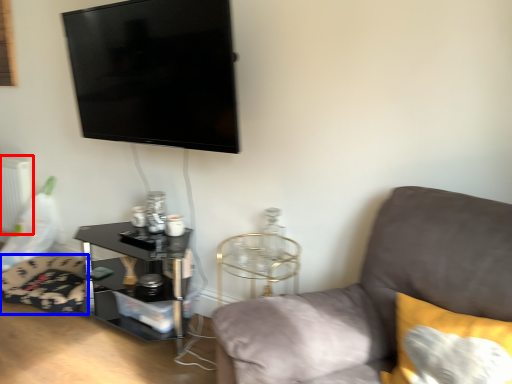
Question: Which of the following is the closest to the observer, radiator (highlighted by a red box) or swivel chair (highlighted by a blue box)?

Choices:
 (A) radiator
 (B) swivel chair

Answer: (B)